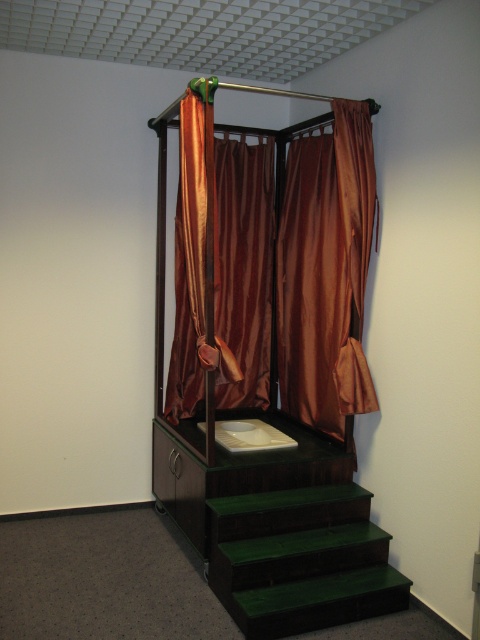
Question: Which point is closer to the camera?

Choices:
 (A) satin brown curtain at center
 (B) green matte/stained wood stairs at lower center

Answer: (B)

Question: Can you confirm if satin brown curtain at center is wider than green matte/stained wood stairs at lower center?

Choices:
 (A) yes
 (B) no

Answer: (A)

Question: Considering the relative positions of satin brown curtain at center and green matte/stained wood stairs at lower center in the image provided, where is satin brown curtain at center located with respect to green matte/stained wood stairs at lower center?

Choices:
 (A) above
 (B) below

Answer: (A)

Question: Is satin brown curtain at center below green matte/stained wood stairs at lower center?

Choices:
 (A) no
 (B) yes

Answer: (A)